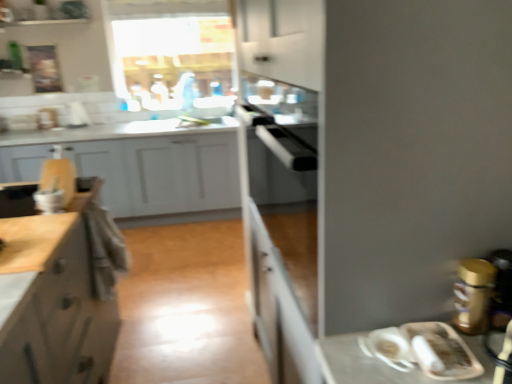
What do you see at coordinates (474, 295) in the screenshot?
I see `gold metallic canister at right` at bounding box center [474, 295].

At what (x,y) coordinates should I click in order to perform the action: click on white matte cabinet at left, placed as the first cabinetry when sorted from back to front. Please return your answer as a coordinate pair (x, y). The image size is (512, 384). Looking at the image, I should click on (162, 172).

Locate an element on the screen. Image resolution: width=512 pixels, height=384 pixels. gold metallic canister at right is located at coordinates (474, 295).

Based on the photo, can you confirm if gold metallic canister at right is bigger than matte white cabinet at left, placed as the 2th cabinetry when sorted from back to front?

No, gold metallic canister at right is not bigger than matte white cabinet at left, placed as the 2th cabinetry when sorted from back to front.

Is matte white cabinet at left, arranged as the second cabinetry when viewed from the front, at the back of gold metallic canister at right?

gold metallic canister at right is not turned away from matte white cabinet at left, arranged as the second cabinetry when viewed from the front.

Is gold metallic canister at right completely or partially outside of matte white cabinet at left, placed as the 2th cabinetry when sorted from back to front?

That's correct, gold metallic canister at right is outside of matte white cabinet at left, placed as the 2th cabinetry when sorted from back to front.

Based on the photo, could you tell me if gold metallic canister at right is turned towards white matte cabinet at left, placed as the first cabinetry when sorted from back to front?

No, gold metallic canister at right is not turned towards white matte cabinet at left, placed as the first cabinetry when sorted from back to front.

Is gold metallic canister at right next to white matte cabinet at left, arranged as the 3th cabinetry when viewed from the front, and touching it?

gold metallic canister at right and white matte cabinet at left, arranged as the 3th cabinetry when viewed from the front, are clearly separated.

Is point (482, 300) closer to viewer compared to point (234, 163)?

That is True.

Identify the location of appliance located above the white matte cabinet at left, arranged as the 3th cabinetry when viewed from the front (from a real-world perspective). The image size is (512, 384). (474, 295).

Looking at the image, does matte white cabinet at left, placed as the 2th cabinetry when sorted from back to front, seem bigger or smaller compared to wooden cutting board at left, which is counted as the 3th cabinetry, starting from the back?

Considering their sizes, matte white cabinet at left, placed as the 2th cabinetry when sorted from back to front, takes up more space than wooden cutting board at left, which is counted as the 3th cabinetry, starting from the back.

Is matte white cabinet at left, placed as the 2th cabinetry when sorted from back to front, in contact with wooden cutting board at left, which is counted as the 3th cabinetry, starting from the back?

There is a gap between matte white cabinet at left, placed as the 2th cabinetry when sorted from back to front, and wooden cutting board at left, which is counted as the 3th cabinetry, starting from the back.

This screenshot has height=384, width=512. In order to click on cabinetry that is the 1st object located behind the wooden cutting board at left, which is counted as the 1th cabinetry, starting from the front in this screenshot , I will do `click(54, 299)`.

From a real-world perspective, relative to matte white cabinet at left, arranged as the second cabinetry when viewed from the front, is wooden cutting board at left, which is counted as the 3th cabinetry, starting from the back, vertically above or below?

wooden cutting board at left, which is counted as the 3th cabinetry, starting from the back, is situated higher than matte white cabinet at left, arranged as the second cabinetry when viewed from the front, in the real world.

Measure the distance between wooden cutting board at left, which is counted as the 1th cabinetry, starting from the front, and matte white cabinet at left, placed as the 2th cabinetry when sorted from back to front.

wooden cutting board at left, which is counted as the 1th cabinetry, starting from the front, is 6.16 feet away from matte white cabinet at left, placed as the 2th cabinetry when sorted from back to front.

Would you say wooden cutting board at left, which is counted as the 3th cabinetry, starting from the back, is inside or outside matte white cabinet at left, placed as the 2th cabinetry when sorted from back to front?

wooden cutting board at left, which is counted as the 3th cabinetry, starting from the back, cannot be found inside matte white cabinet at left, placed as the 2th cabinetry when sorted from back to front.

Is wooden cutting board at left, which is counted as the 1th cabinetry, starting from the front, touching matte white cabinet at left, placed as the 2th cabinetry when sorted from back to front?

They are not placed beside each other.

Which of these two, wooden cutting board at left, which is counted as the 1th cabinetry, starting from the front, or gold metallic canister at right, stands taller?

With more height is wooden cutting board at left, which is counted as the 1th cabinetry, starting from the front.

Which is behind, point (95, 146) or point (472, 273)?

The point (95, 146) is behind.

From a real-world perspective, between wooden cutting board at left, which is counted as the 3th cabinetry, starting from the back, and gold metallic canister at right, who is vertically lower?

gold metallic canister at right is physically lower.

Is wooden cutting board at left, which is counted as the 1th cabinetry, starting from the front, positioned far away from gold metallic canister at right?

wooden cutting board at left, which is counted as the 1th cabinetry, starting from the front, is far away from gold metallic canister at right.

Between matte white cabinet at left, arranged as the second cabinetry when viewed from the front, and gold metallic canister at right, which one has more height?

matte white cabinet at left, arranged as the second cabinetry when viewed from the front.

Relative to gold metallic canister at right, is matte white cabinet at left, arranged as the second cabinetry when viewed from the front, in front or behind?

Visually, matte white cabinet at left, arranged as the second cabinetry when viewed from the front, is located behind gold metallic canister at right.

From the image's perspective, relative to gold metallic canister at right, is matte white cabinet at left, arranged as the second cabinetry when viewed from the front, above or below?

matte white cabinet at left, arranged as the second cabinetry when viewed from the front, is below gold metallic canister at right.

From the picture: From the image's perspective, relative to wooden cutting board at left, which is counted as the 1th cabinetry, starting from the front, is gold metallic canister at right above or below?

Based on their image positions, gold metallic canister at right is located beneath wooden cutting board at left, which is counted as the 1th cabinetry, starting from the front.

Which of these two, gold metallic canister at right or wooden cutting board at left, which is counted as the 1th cabinetry, starting from the front, stands taller?

Standing taller between the two is wooden cutting board at left, which is counted as the 1th cabinetry, starting from the front.

Between point (478, 329) and point (30, 146), which one is positioned in front?

Positioned in front is point (478, 329).

The height and width of the screenshot is (384, 512). I want to click on cabinetry that is the 1st object to the left of the gold metallic canister at right, starting at the anchor, so click(103, 171).

From the gold metallic canister at right, count 2nd cabinetrys backward and point to it. Please provide its 2D coordinates.

[(54, 299)]

Locate an element on the screen. The width and height of the screenshot is (512, 384). appliance on the right of white matte cabinet at left, placed as the first cabinetry when sorted from back to front is located at coordinates (474, 295).

Which object lies further to the anchor point wooden cutting board at left, which is counted as the 3th cabinetry, starting from the back, gold metallic canister at right or matte white cabinet at left, placed as the 2th cabinetry when sorted from back to front?

gold metallic canister at right lies further to wooden cutting board at left, which is counted as the 3th cabinetry, starting from the back, than the other object.

From the image, which object appears to be farther from white matte cabinet at left, arranged as the 3th cabinetry when viewed from the front, gold metallic canister at right or wooden cutting board at left, which is counted as the 3th cabinetry, starting from the back?

gold metallic canister at right.

Based on their spatial positions, is wooden cutting board at left, which is counted as the 3th cabinetry, starting from the back, or white matte cabinet at left, arranged as the 3th cabinetry when viewed from the front, closer to matte white cabinet at left, arranged as the second cabinetry when viewed from the front?

Among the two, white matte cabinet at left, arranged as the 3th cabinetry when viewed from the front, is located nearer to matte white cabinet at left, arranged as the second cabinetry when viewed from the front.

Considering their positions, is gold metallic canister at right positioned further to white matte cabinet at left, placed as the first cabinetry when sorted from back to front, than matte white cabinet at left, arranged as the second cabinetry when viewed from the front?

The object further to white matte cabinet at left, placed as the first cabinetry when sorted from back to front, is gold metallic canister at right.

Considering their positions, is wooden cutting board at left, which is counted as the 3th cabinetry, starting from the back, positioned closer to white matte cabinet at left, placed as the first cabinetry when sorted from back to front, than gold metallic canister at right?

wooden cutting board at left, which is counted as the 3th cabinetry, starting from the back.

Looking at the image, which one is located closer to wooden cutting board at left, which is counted as the 1th cabinetry, starting from the front, white matte cabinet at left, arranged as the 3th cabinetry when viewed from the front, or gold metallic canister at right?

white matte cabinet at left, arranged as the 3th cabinetry when viewed from the front, is positioned closer to the anchor wooden cutting board at left, which is counted as the 1th cabinetry, starting from the front.

Considering their positions, is matte white cabinet at left, placed as the 2th cabinetry when sorted from back to front, positioned further to white matte cabinet at left, placed as the first cabinetry when sorted from back to front, than wooden cutting board at left, which is counted as the 1th cabinetry, starting from the front?

The object further to white matte cabinet at left, placed as the first cabinetry when sorted from back to front, is matte white cabinet at left, placed as the 2th cabinetry when sorted from back to front.

Estimate the real-world distances between objects in this image. Which object is closer to matte white cabinet at left, arranged as the second cabinetry when viewed from the front, white matte cabinet at left, placed as the first cabinetry when sorted from back to front, or gold metallic canister at right?

gold metallic canister at right.

You are a GUI agent. You are given a task and a screenshot of the screen. Output one action in this format:
    pyautogui.click(x=<x>, y=<y>)
    Task: Click on the cabinetry between wooden cutting board at left, which is counted as the 3th cabinetry, starting from the back, and white matte cabinet at left, arranged as the 3th cabinetry when viewed from the front, from front to back
    The width and height of the screenshot is (512, 384).
    Given the screenshot: What is the action you would take?
    pyautogui.click(x=54, y=299)

Identify the location of cabinetry between matte white cabinet at left, arranged as the second cabinetry when viewed from the front, and gold metallic canister at right, in the horizontal direction. This screenshot has height=384, width=512. (103, 171).